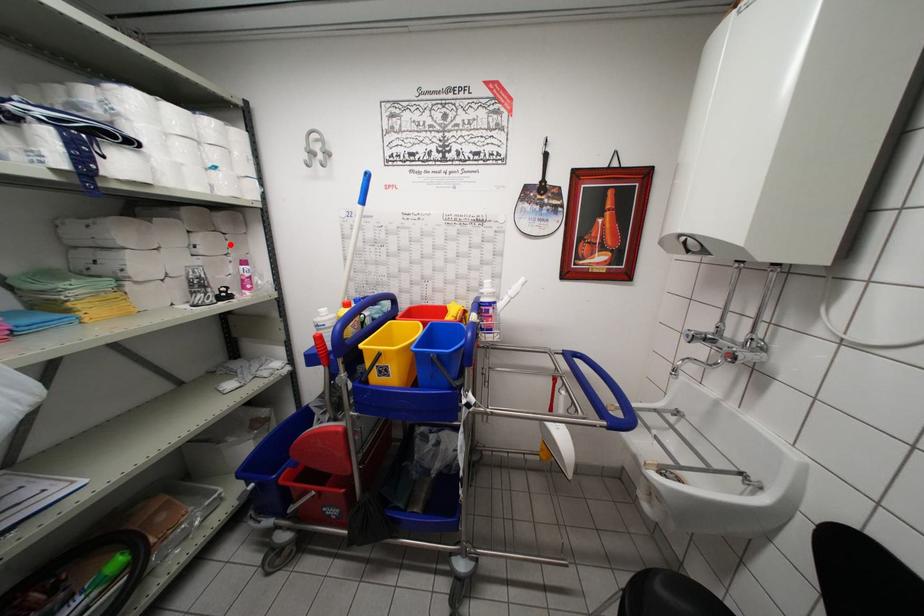
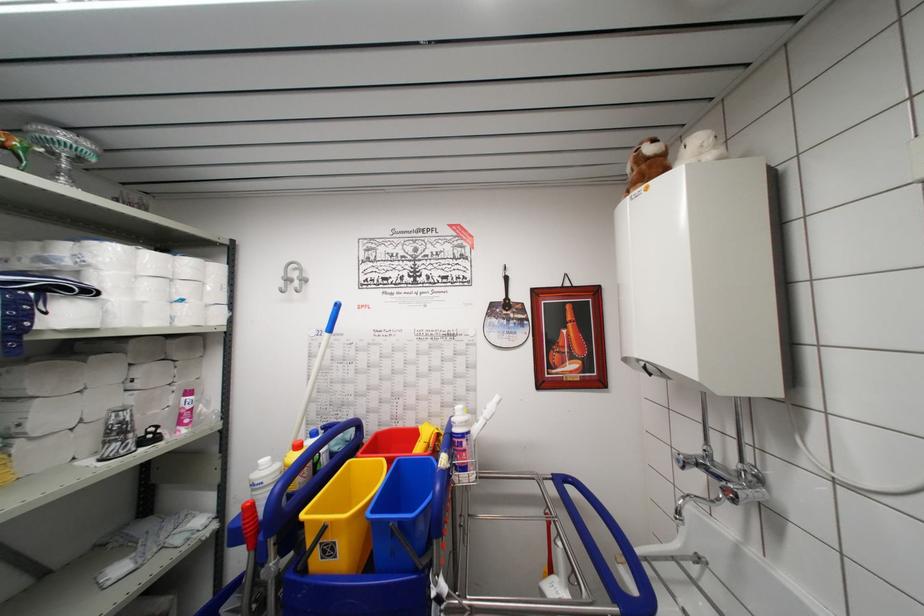
Find the pixel in the second image that matches the highlighted location in the first image.

(178, 371)